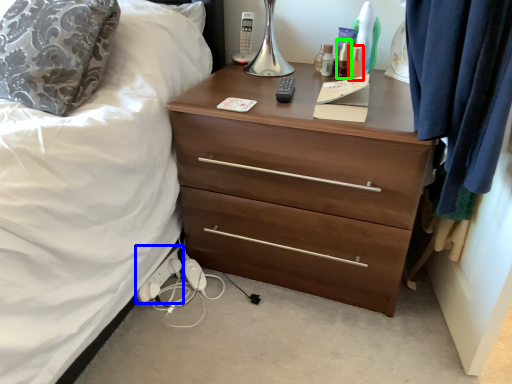
Question: Considering the real-world distances, which object is closest to toiletry (highlighted by a red box)? extension cord (highlighted by a blue box) or toiletry (highlighted by a green box).

Choices:
 (A) extension cord
 (B) toiletry

Answer: (B)